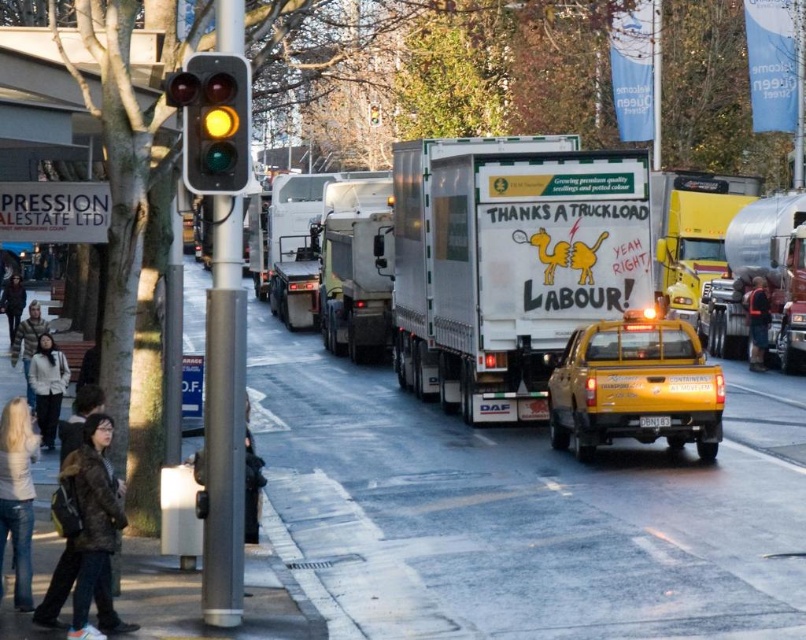
Question: Estimate the real-world distances between objects in this image. Which object is closer to the brown textured jacket at lower left?

Choices:
 (A) light brown leather jacket at lower left
 (B) white matte truck at center

Answer: (A)

Question: Is brown textured jacket at lower left thinner than yellow glass traffic light at upper center?

Choices:
 (A) no
 (B) yes

Answer: (A)

Question: Can you confirm if white glossy truck at center is smaller than brown textured jacket at lower left?

Choices:
 (A) yes
 (B) no

Answer: (B)

Question: In this image, where is white glossy truck at center located relative to orange reflective vest at center?

Choices:
 (A) above
 (B) below

Answer: (A)

Question: Which object appears farthest from the camera in this image?

Choices:
 (A) light brown leather jacket at lower left
 (B) white glossy truck at center

Answer: (B)

Question: Which is nearer to the white fleece jacket at lower left?

Choices:
 (A) yellow glass traffic light at upper center
 (B) brown fabric backpack at lower left
 (C) yellow matte truck at center
 (D) light brown leather jacket at lower left

Answer: (B)